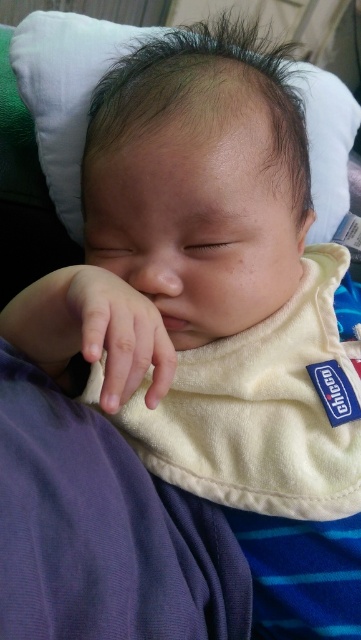
Question: Does white soft pillow at upper center have a smaller size compared to smooth skin hand at center?

Choices:
 (A) no
 (B) yes

Answer: (A)

Question: Is white soft pillow at upper center in front of smooth skin hand at center?

Choices:
 (A) no
 (B) yes

Answer: (A)

Question: Among these objects, which one is farthest from the camera?

Choices:
 (A) smooth skin hand at center
 (B) white soft pillow at upper center

Answer: (B)

Question: Can you confirm if white soft pillow at upper center is positioned to the right of smooth skin hand at center?

Choices:
 (A) no
 (B) yes

Answer: (B)

Question: Among these points, which one is nearest to the camera?

Choices:
 (A) (131, 339)
 (B) (337, 177)

Answer: (A)